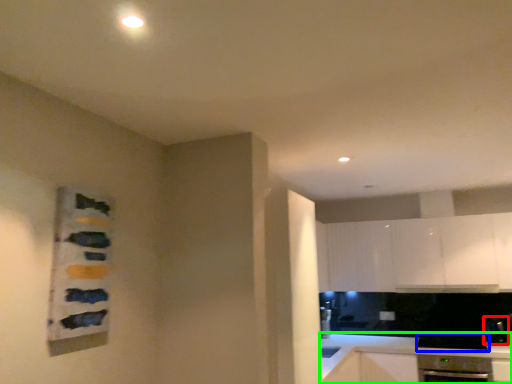
Question: Which is farther away from appliance (highlighted by a red box)? appliance (highlighted by a blue box) or countertop (highlighted by a green box)?

Choices:
 (A) appliance
 (B) countertop

Answer: (B)